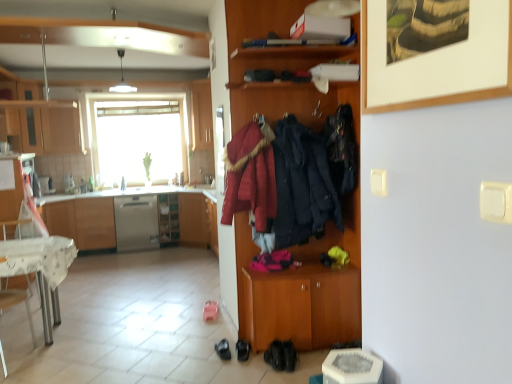
Question: Considering the relative positions of satin silver dishwasher at center and wooden coat rack at center, the 4th cabinetry positioned from the left, in the image provided, is satin silver dishwasher at center to the right of wooden coat rack at center, the 4th cabinetry positioned from the left, from the viewer's perspective?

Choices:
 (A) yes
 (B) no

Answer: (B)

Question: Is satin silver dishwasher at center positioned behind wooden coat rack at center, which is the 4th cabinetry in back-to-front order?

Choices:
 (A) no
 (B) yes

Answer: (B)

Question: Does satin silver dishwasher at center have a greater height compared to wooden coat rack at center, the 1th cabinetry when ordered from right to left?

Choices:
 (A) yes
 (B) no

Answer: (B)

Question: Can you confirm if satin silver dishwasher at center is positioned to the left of wooden coat rack at center, which is the 4th cabinetry in back-to-front order?

Choices:
 (A) no
 (B) yes

Answer: (B)

Question: Is satin silver dishwasher at center looking in the opposite direction of wooden coat rack at center, which is the 4th cabinetry in back-to-front order?

Choices:
 (A) no
 (B) yes

Answer: (A)

Question: Considering the positions of metallic silver cabinet at left, arranged as the third cabinetry when viewed from the right, and white glossy desk at lower left in the image, is metallic silver cabinet at left, arranged as the third cabinetry when viewed from the right, bigger or smaller than white glossy desk at lower left?

Choices:
 (A) small
 (B) big

Answer: (A)

Question: Considering the relative positions of metallic silver cabinet at left, the 2th cabinetry from the left, and white glossy desk at lower left in the image provided, is metallic silver cabinet at left, the 2th cabinetry from the left, to the left or to the right of white glossy desk at lower left?

Choices:
 (A) left
 (B) right

Answer: (A)

Question: From a real-world perspective, is metallic silver cabinet at left, the 3th cabinetry when ordered from back to front, physically located above or below white glossy desk at lower left?

Choices:
 (A) below
 (B) above

Answer: (B)

Question: From the image's perspective, is metallic silver cabinet at left, arranged as the 2th cabinetry when viewed from the front, located above or below white glossy desk at lower left?

Choices:
 (A) above
 (B) below

Answer: (A)

Question: Would you say white glossy pendant light at upper center is inside or outside black leather shoes at lower center, which is counted as the 1th footwear, starting from the left?

Choices:
 (A) outside
 (B) inside

Answer: (A)

Question: Is white glossy pendant light at upper center taller or shorter than black leather shoes at lower center, which is counted as the third footwear, starting from the right?

Choices:
 (A) tall
 (B) short

Answer: (A)

Question: Relative to black leather shoes at lower center, which is counted as the third footwear, starting from the right, is white glossy pendant light at upper center in front or behind?

Choices:
 (A) front
 (B) behind

Answer: (B)

Question: From a real-world perspective, is white glossy pendant light at upper center physically located above or below black leather shoes at lower center, which is counted as the 1th footwear, starting from the left?

Choices:
 (A) below
 (B) above

Answer: (B)

Question: From the image's perspective, is velvet-like dark blue coat at center, which is counted as the second clothing, starting from the right, positioned above or below satin wood cabinet at left, the 3th cabinetry from the left?

Choices:
 (A) below
 (B) above

Answer: (B)

Question: Based on their positions, is velvet-like dark blue coat at center, which is counted as the second clothing, starting from the right, located to the left or right of satin wood cabinet at left, arranged as the fourth cabinetry when viewed from the front?

Choices:
 (A) right
 (B) left

Answer: (A)